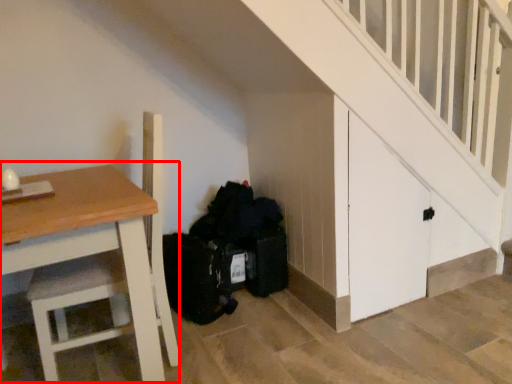
Question: From the image's perspective, what is the correct spatial relationship of table (annotated by the red box) in relation to garbage?

Choices:
 (A) below
 (B) above

Answer: (A)